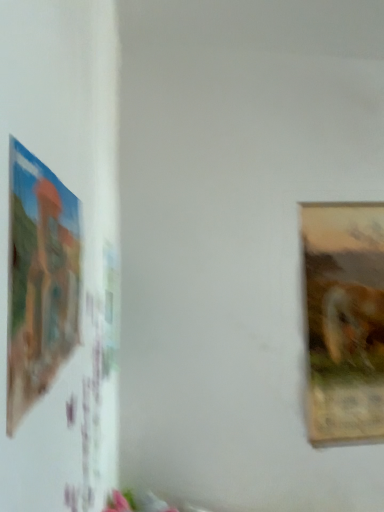
Question: From a real-world perspective, is matte plastic picture frame at left, the 2th picture frame from the right, positioned over wooden textured frame at right, positioned as the 1th picture frame in right-to-left order, based on gravity?

Choices:
 (A) no
 (B) yes

Answer: (B)

Question: Is wooden textured frame at right, the second picture frame in the left-to-right sequence, located within matte plastic picture frame at left, marked as the second picture frame in a back-to-front arrangement?

Choices:
 (A) no
 (B) yes

Answer: (A)

Question: Can you confirm if matte plastic picture frame at left, the 1th picture frame in the front-to-back sequence, is positioned to the left of wooden textured frame at right, positioned as the 1th picture frame in right-to-left order?

Choices:
 (A) no
 (B) yes

Answer: (B)

Question: From the image's perspective, is matte plastic picture frame at left, marked as the second picture frame in a back-to-front arrangement, above wooden textured frame at right, marked as the 1th picture frame in a back-to-front arrangement?

Choices:
 (A) no
 (B) yes

Answer: (B)

Question: Considering the relative positions of matte plastic picture frame at left, the 2th picture frame from the right, and wooden textured frame at right, the second picture frame in the left-to-right sequence, in the image provided, is matte plastic picture frame at left, the 2th picture frame from the right, to the right of wooden textured frame at right, the second picture frame in the left-to-right sequence, from the viewer's perspective?

Choices:
 (A) yes
 (B) no

Answer: (B)

Question: Can you confirm if matte plastic picture frame at left, the 2th picture frame from the right, is wider than wooden textured frame at right, marked as the 1th picture frame in a back-to-front arrangement?

Choices:
 (A) no
 (B) yes

Answer: (A)

Question: From a real-world perspective, is wooden textured frame at right, arranged as the 2th picture frame when viewed from the front, under matte plastic picture frame at left, the 2th picture frame from the right?

Choices:
 (A) no
 (B) yes

Answer: (B)

Question: Is wooden textured frame at right, arranged as the 2th picture frame when viewed from the front, further to the viewer compared to matte plastic picture frame at left, arranged as the first picture frame when viewed from the left?

Choices:
 (A) no
 (B) yes

Answer: (B)

Question: From a real-world perspective, is wooden textured frame at right, arranged as the 2th picture frame when viewed from the front, on top of matte plastic picture frame at left, the 1th picture frame in the front-to-back sequence?

Choices:
 (A) yes
 (B) no

Answer: (B)

Question: Could you tell me if wooden textured frame at right, the second picture frame in the left-to-right sequence, is facing matte plastic picture frame at left, the 1th picture frame in the front-to-back sequence?

Choices:
 (A) yes
 (B) no

Answer: (B)

Question: Considering the relative sizes of wooden textured frame at right, arranged as the 2th picture frame when viewed from the front, and matte plastic picture frame at left, the 2th picture frame from the right, in the image provided, is wooden textured frame at right, arranged as the 2th picture frame when viewed from the front, shorter than matte plastic picture frame at left, the 2th picture frame from the right,?

Choices:
 (A) no
 (B) yes

Answer: (A)

Question: Can you confirm if wooden textured frame at right, arranged as the 2th picture frame when viewed from the front, is thinner than matte plastic picture frame at left, the 2th picture frame from the right?

Choices:
 (A) yes
 (B) no

Answer: (B)

Question: In the image, is matte plastic picture frame at left, arranged as the first picture frame when viewed from the left, on the left side or the right side of wooden textured frame at right, arranged as the 2th picture frame when viewed from the front?

Choices:
 (A) left
 (B) right

Answer: (A)